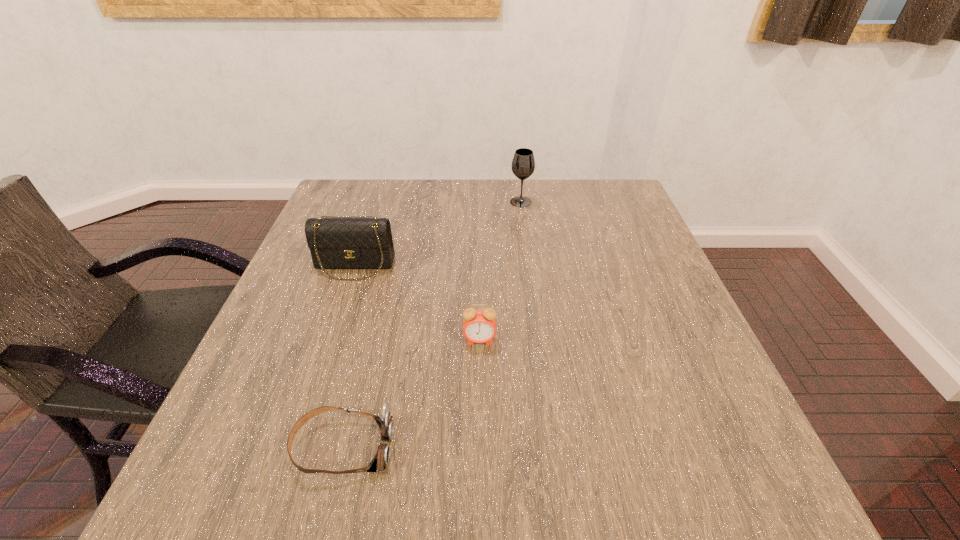
The width and height of the screenshot is (960, 540). In order to click on wineglass in this screenshot , I will do `click(523, 164)`.

Identify the location of the tallest object. (523, 164).

The height and width of the screenshot is (540, 960). In order to click on the third shortest object in this screenshot , I will do `click(335, 243)`.

At what (x,y) coordinates should I click in order to perform the action: click on the second farthest object. Please return your answer as a coordinate pair (x, y). Looking at the image, I should click on (335, 243).

Locate an element on the screen. the second nearest object is located at coordinates (479, 326).

At what (x,y) coordinates should I click in order to perform the action: click on the second object from right to left. Please return your answer as a coordinate pair (x, y). This screenshot has width=960, height=540. Looking at the image, I should click on (479, 326).

Identify the location of goggles. (385, 422).

Locate an element on the screen. the shortest object is located at coordinates (385, 422).

This screenshot has width=960, height=540. What are the coordinates of `vacant space located 0.200m on the front of the tallest object` in the screenshot? It's located at (527, 251).

Where is `vacant space positioned on the front flap of the clutch bag`? The image size is (960, 540). vacant space positioned on the front flap of the clutch bag is located at coordinates (309, 401).